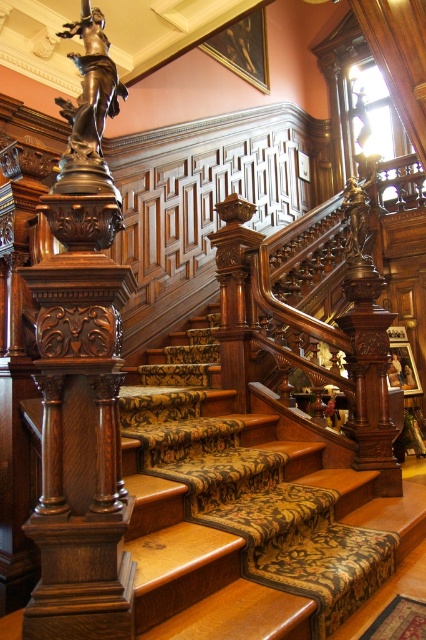
You are standing at the bottom of the staircase in the grand building. You notice two points marked on the wall. The first point is at coordinate point [57,406] and the second is at point [114,86]. From your current position, which point is closer to you?

Point [57,406] is in front of point [114,86], so the first point is closer to you.